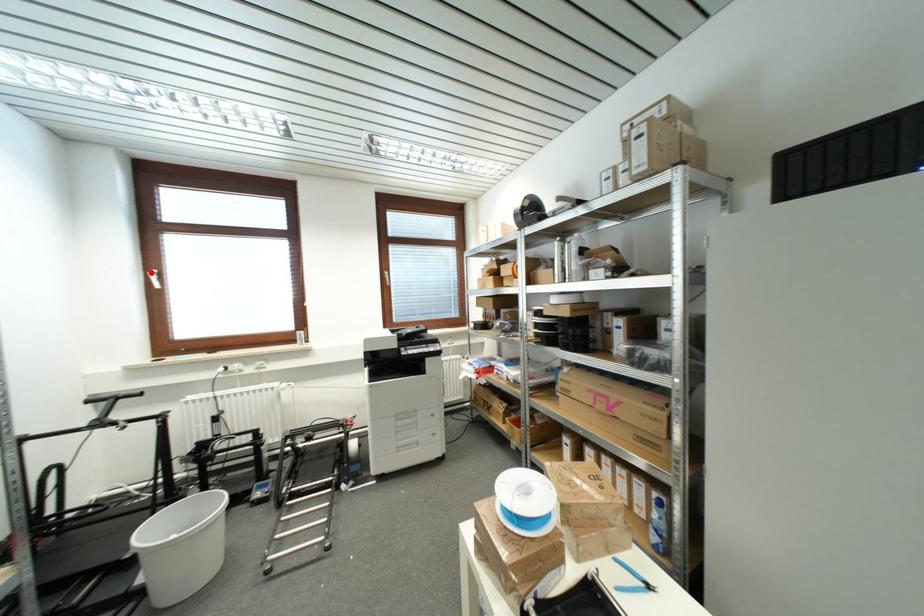
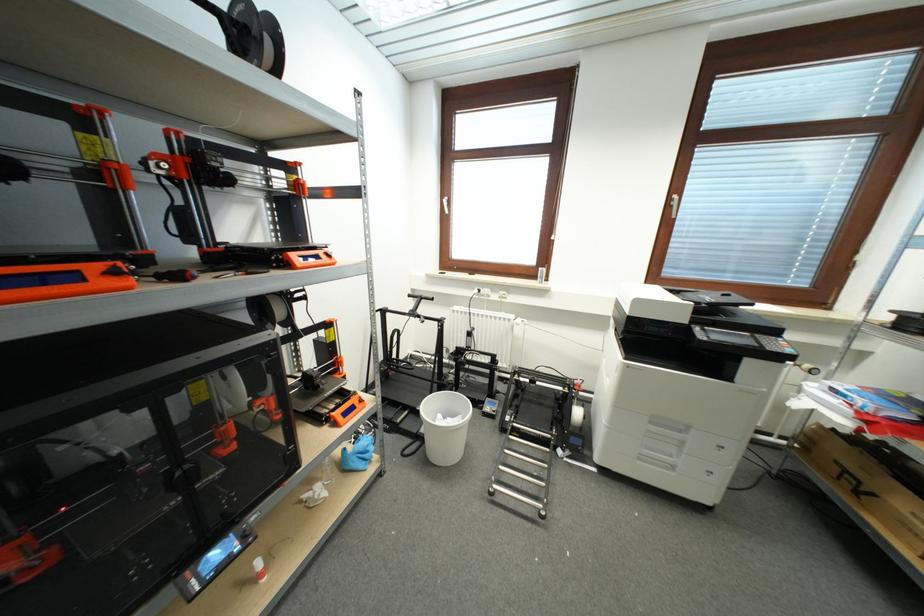
Question: I am providing you with two images of the same scene from different viewpoints. Image1 has a red point marked. In image2, the corresponding 3D location appears at what relative position? Reply with the corresponding letter.

Choices:
 (A) Closer
 (B) Farther

Answer: (A)